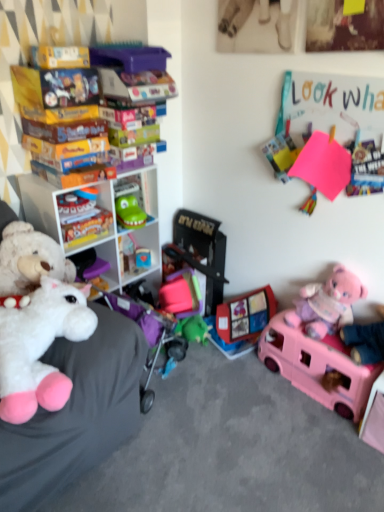
Question: From a real-world perspective, is pink plush teddy bear at lower right positioned above or below plastic toy car at center, the third toy from the left?

Choices:
 (A) below
 (B) above

Answer: (B)

Question: In the image, is pink plush teddy bear at lower right on the left side or the right side of plastic toy car at center, which is counted as the third toy, starting from the right?

Choices:
 (A) right
 (B) left

Answer: (A)

Question: Which object is the closest to the matte plastic toy at center, the 4th toy from the left?

Choices:
 (A) plastic toy car at center, which is counted as the third toy, starting from the right
 (B) soft gray bean bag at left
 (C) white plastic shelf at left, placed as the second shelf when sorted from top to bottom
 (D) pink plush teddy bear at lower right
 (E) smooth plastic toy at center, which ranks as the second toy in left-to-right order

Answer: (A)

Question: Based on their relative distances, which object is farther from the smooth plastic toy at center, which ranks as the second toy in left-to-right order?

Choices:
 (A) plastic toy car at center, which is counted as the third toy, starting from the right
 (B) matte plastic toy at center, acting as the second toy starting from the right
 (C) soft gray bean bag at left
 (D) pink plush teddy bear at lower right
 (E) white plastic shelf at left, placed as the second shelf when sorted from top to bottom

Answer: (C)